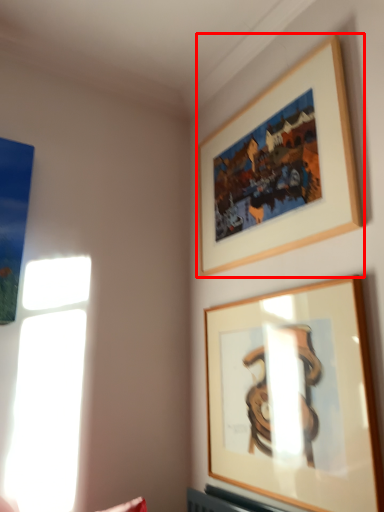
Question: Observing the image, what is the correct spatial positioning of picture frame (annotated by the red box) in reference to picture frame?

Choices:
 (A) right
 (B) left

Answer: (B)